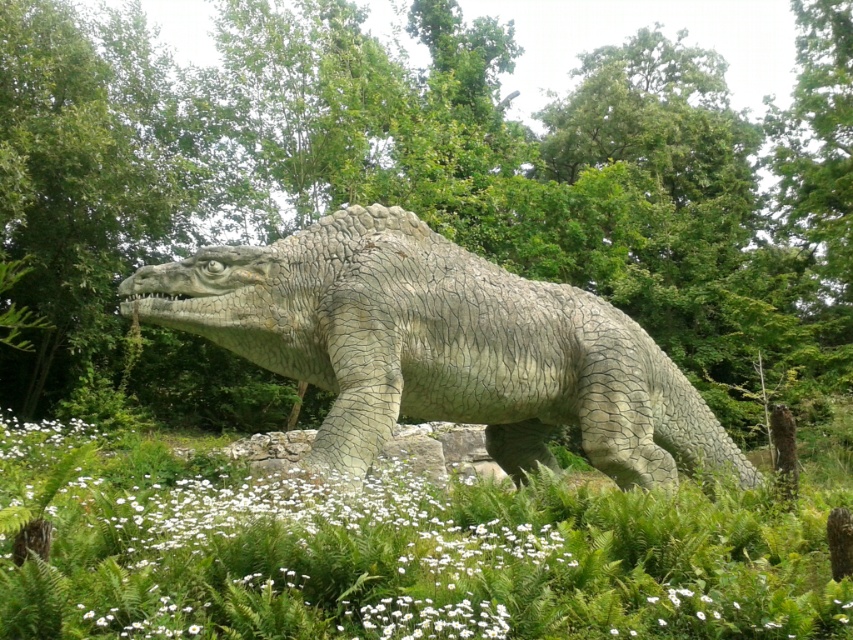
Question: Which object is the closest to the green leafy grass at center?

Choices:
 (A) green leafy plants at center
 (B) white matte flower at center
 (C) gray textured dinosaur at center

Answer: (B)

Question: Which point is closer to the camera taking this photo?

Choices:
 (A) (158, 243)
 (B) (637, 531)

Answer: (B)

Question: Is green leafy plants at center positioned in front of white matte flower at center?

Choices:
 (A) no
 (B) yes

Answer: (A)

Question: Estimate the real-world distances between objects in this image. Which object is closer to the green leafy plants at center?

Choices:
 (A) green leafy grass at center
 (B) white matte flower at center
 (C) gray textured dinosaur at center

Answer: (A)

Question: Is the position of green leafy plants at center less distant than that of gray textured dinosaur at center?

Choices:
 (A) no
 (B) yes

Answer: (A)

Question: Can you confirm if green leafy grass at center is positioned to the right of gray textured dinosaur at center?

Choices:
 (A) yes
 (B) no

Answer: (B)